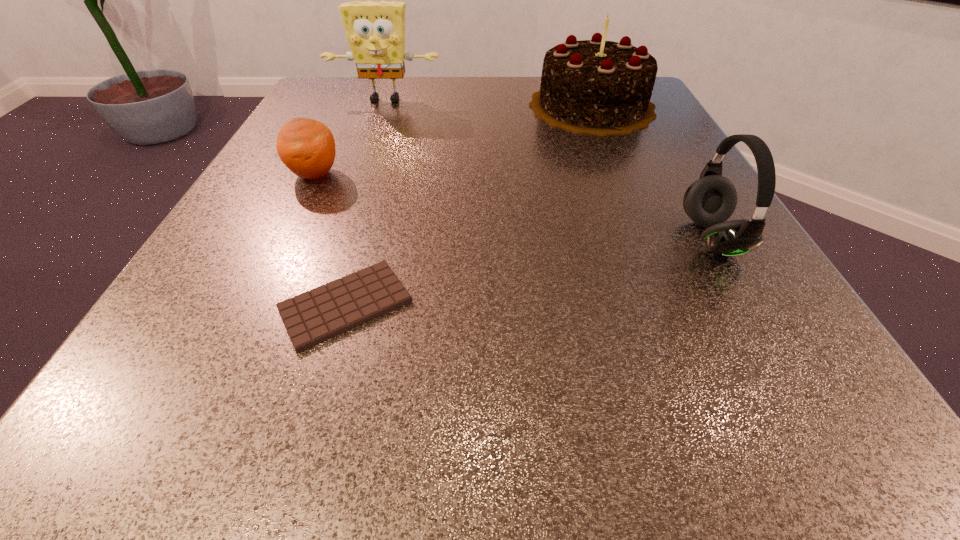
You are a GUI agent. You are given a task and a screenshot of the screen. Output one action in this format:
    pyautogui.click(x=<x>, y=<y>)
    Task: Click on the blank space located 0.320m on the ear cups of the headset
    This screenshot has height=540, width=960.
    Given the screenshot: What is the action you would take?
    pyautogui.click(x=467, y=238)

The width and height of the screenshot is (960, 540). Identify the location of free space located on the back of the second shortest object. (333, 134).

The image size is (960, 540). What are the coordinates of `blank area located on the back of the chocolate bar` in the screenshot? It's located at (395, 132).

The height and width of the screenshot is (540, 960). I want to click on sponge present at the far edge, so click(x=375, y=30).

Where is `birthday cake located at the far edge`? The width and height of the screenshot is (960, 540). birthday cake located at the far edge is located at coordinates (598, 87).

You are a GUI agent. You are given a task and a screenshot of the screen. Output one action in this format:
    pyautogui.click(x=<x>, y=<y>)
    Task: Click on the sponge at the left edge
    The width and height of the screenshot is (960, 540).
    Given the screenshot: What is the action you would take?
    pyautogui.click(x=375, y=30)

Identify the location of orange that is at the left edge. This screenshot has height=540, width=960. (306, 146).

This screenshot has height=540, width=960. I want to click on chocolate bar that is at the left edge, so click(314, 316).

You are a GUI agent. You are given a task and a screenshot of the screen. Output one action in this format:
    pyautogui.click(x=<x>, y=<y>)
    Task: Click on the birthday cake at the right edge
    
    Given the screenshot: What is the action you would take?
    pyautogui.click(x=598, y=87)

In order to click on headset that is at the right edge in this screenshot , I will do `click(710, 201)`.